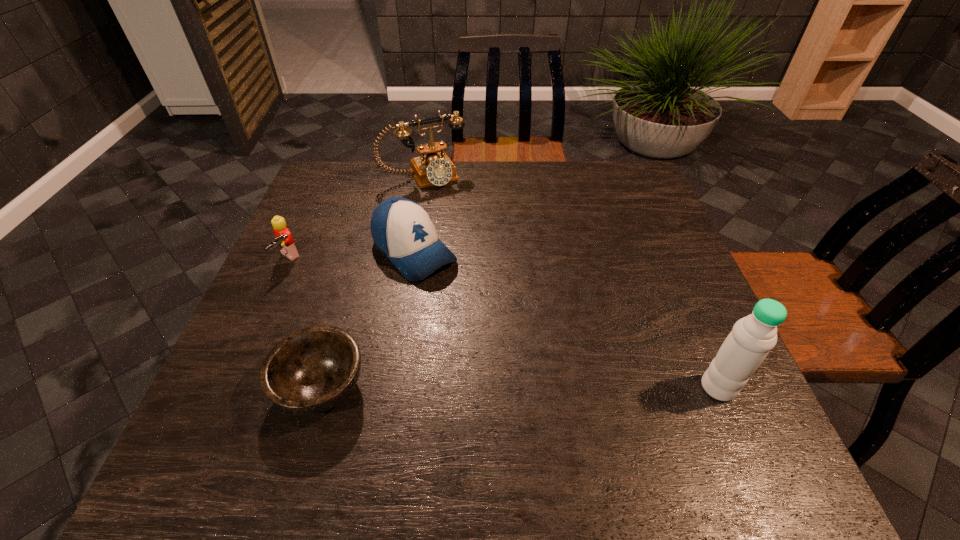
Identify the location of unoccupied position between the shortest object and the baseball cap. The height and width of the screenshot is (540, 960). (368, 320).

Identify which object is located as the second nearest to the baseball cap. Please provide its 2D coordinates. Your answer should be formatted as a tuple, i.e. [(x, y)], where the tuple contains the x and y coordinates of a point satisfying the conditions above.

[(284, 239)]

Identify the location of object that stands as the closest to the leftmost object. This screenshot has width=960, height=540. (402, 230).

Locate an element on the screen. The height and width of the screenshot is (540, 960). free spot that satisfies the following two spatial constraints: 1. on the front side of the Lego; 2. on the left side of the bowl is located at coordinates pyautogui.click(x=230, y=388).

At what (x,y) coordinates should I click in order to perform the action: click on free space that satisfies the following two spatial constraints: 1. on the front side of the water bottle; 2. on the right side of the baseball cap. Please return your answer as a coordinate pair (x, y). Looking at the image, I should click on [393, 387].

At what (x,y) coordinates should I click in order to perform the action: click on blank area in the image that satisfies the following two spatial constraints: 1. on the back side of the baseball cap; 2. on the left side of the bowl. Please return your answer as a coordinate pair (x, y). The image size is (960, 540). Looking at the image, I should click on (361, 252).

This screenshot has width=960, height=540. In order to click on free space that satisfies the following two spatial constraints: 1. on the back side of the Lego; 2. on the right side of the second tallest object in this screenshot , I will do `click(325, 177)`.